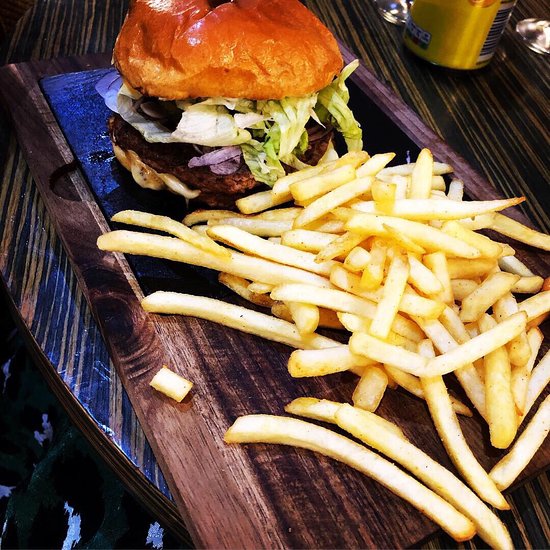
Find the location of `brown wood plate`. brown wood plate is located at coordinates (146, 345).